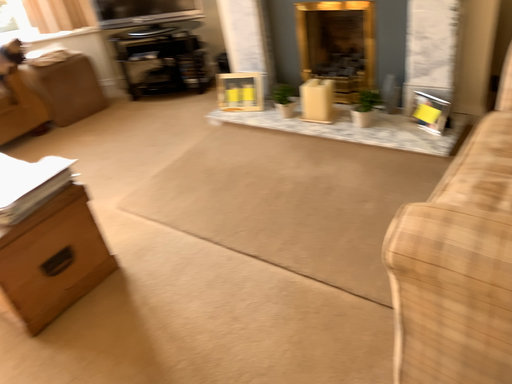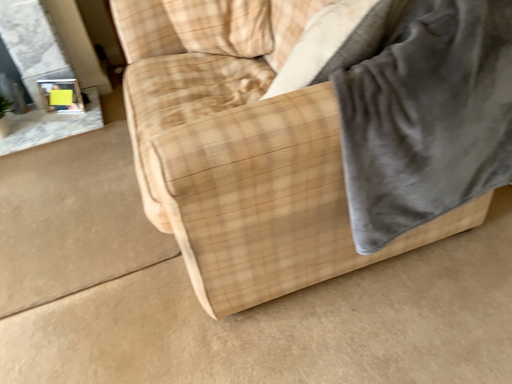
Question: How did the camera likely rotate when shooting the video?

Choices:
 (A) rotated left
 (B) rotated right

Answer: (B)